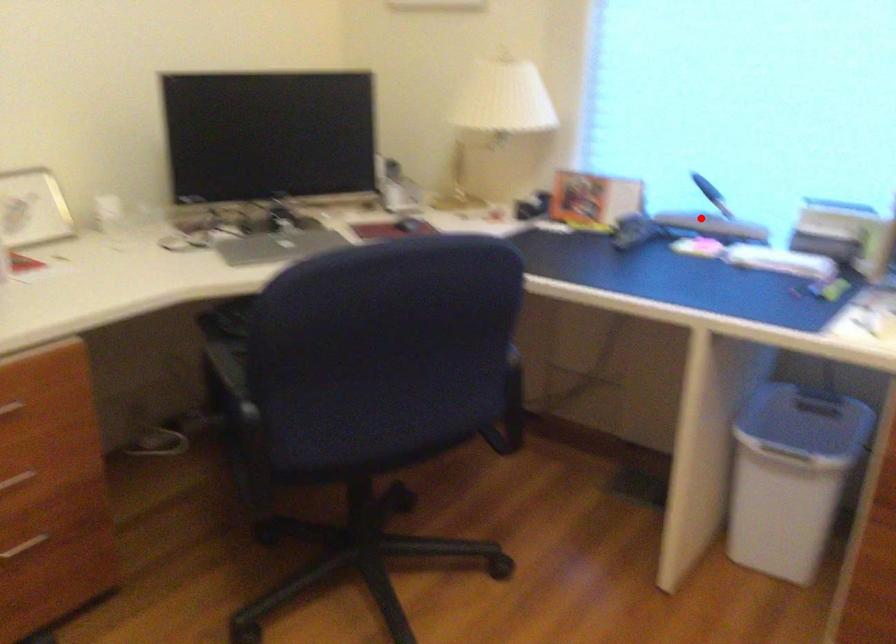
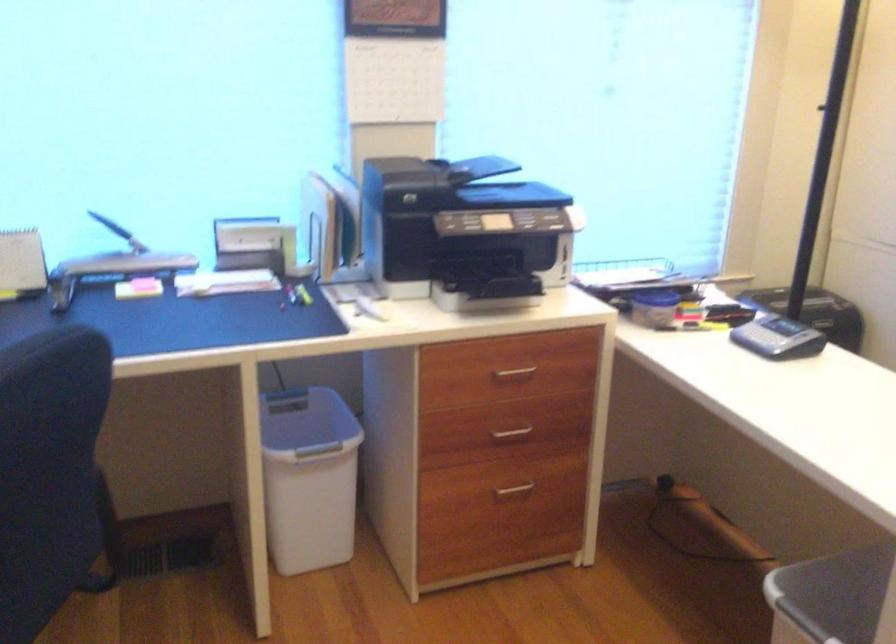
Locate, in the second image, the point that corresponds to the highlighted location in the first image.

(124, 257)